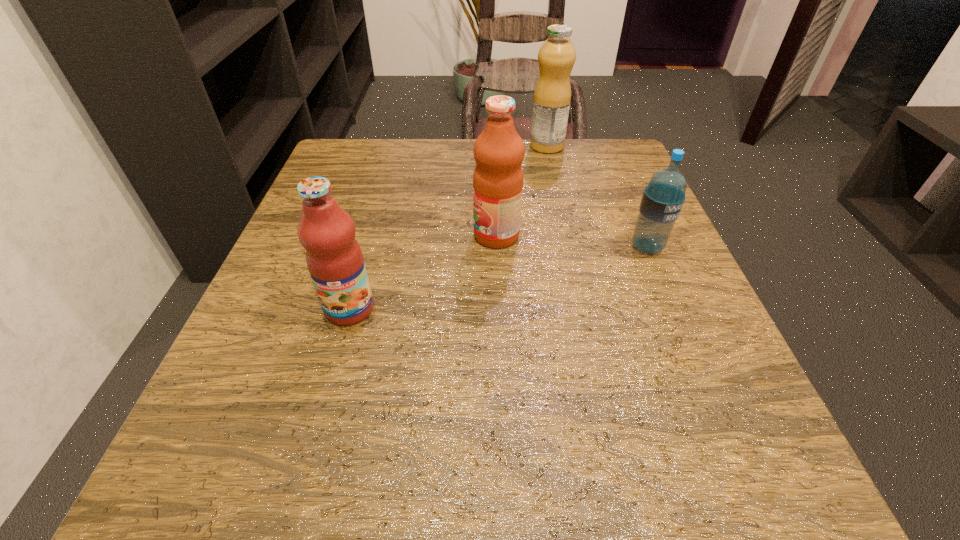
Find the location of a particular element. This screenshot has width=960, height=540. object positioned at the far right corner is located at coordinates 552,96.

In the image, there is a desktop. Where is `blank space at the far edge`? blank space at the far edge is located at coordinates (551, 166).

Identify the location of free space at the near edge. (370, 496).

In the image, there is a desktop. Identify the location of vacant region at the left edge. This screenshot has height=540, width=960. (239, 404).

This screenshot has width=960, height=540. In the image, there is a desktop. Find the location of `free space at the right edge`. free space at the right edge is located at coordinates (639, 374).

Image resolution: width=960 pixels, height=540 pixels. In the image, there is a desktop. In order to click on vacant region at the far left corner in this screenshot , I will do `click(380, 181)`.

This screenshot has height=540, width=960. I want to click on free point at the far right corner, so click(637, 178).

At what (x,y) coordinates should I click in order to perform the action: click on free region at the near right corner of the desktop. Please return your answer as a coordinate pair (x, y). Image resolution: width=960 pixels, height=540 pixels. Looking at the image, I should click on (681, 476).

Where is `free space between the rightmost object and the nearest object`? This screenshot has height=540, width=960. free space between the rightmost object and the nearest object is located at coordinates (498, 278).

Locate an element on the screen. This screenshot has width=960, height=540. free space that is in between the leftmost object and the farthest object is located at coordinates (448, 227).